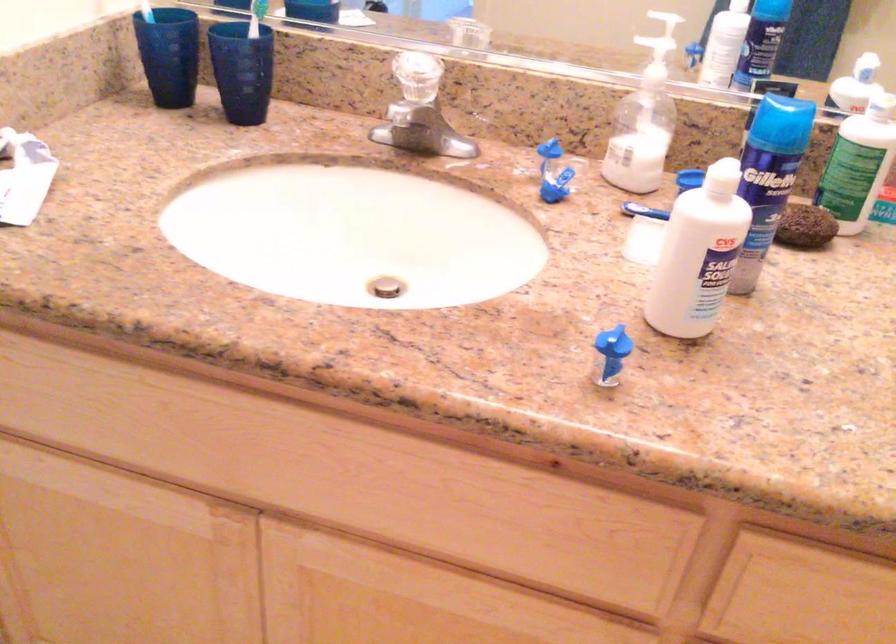
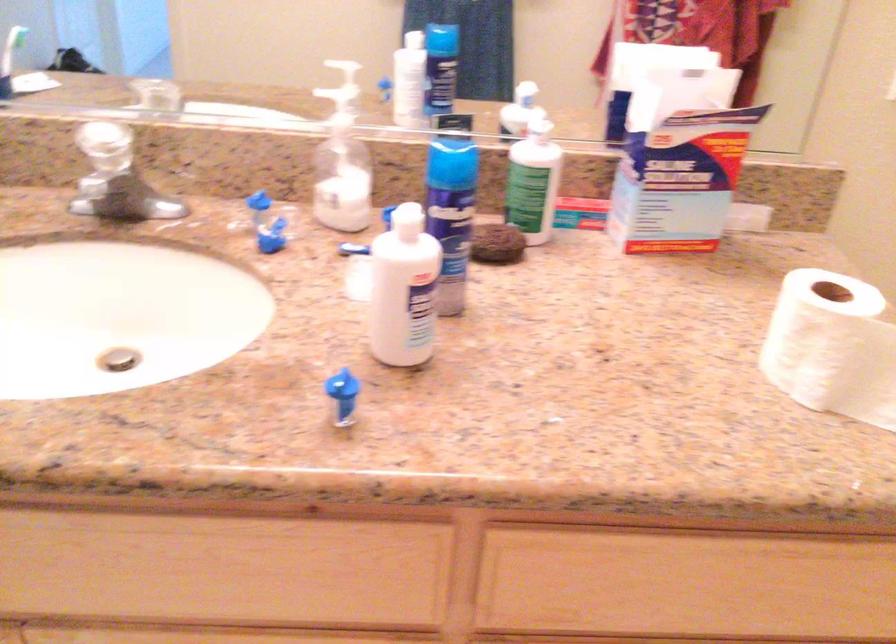
Locate, in the second image, the point that corresponds to (779,120) in the first image.

(451, 158)